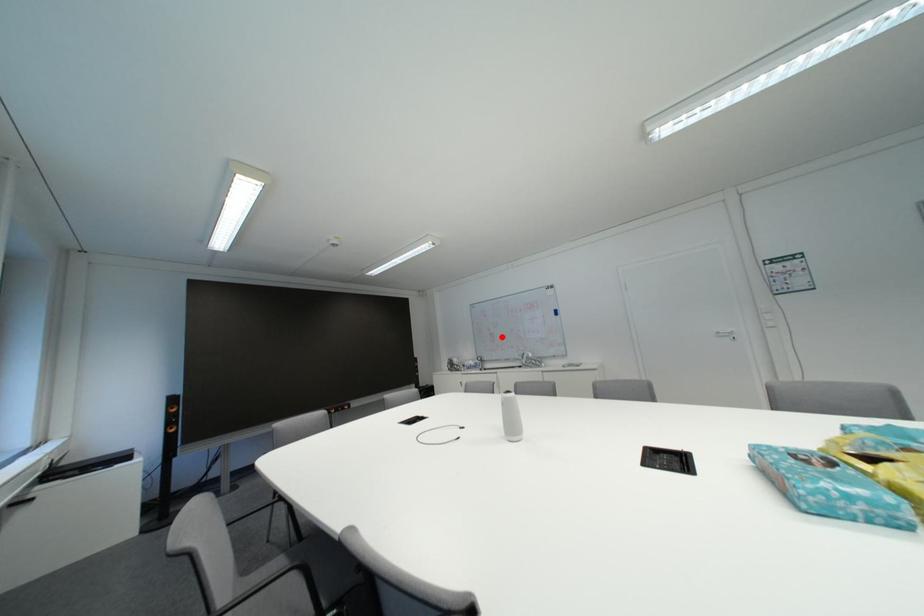
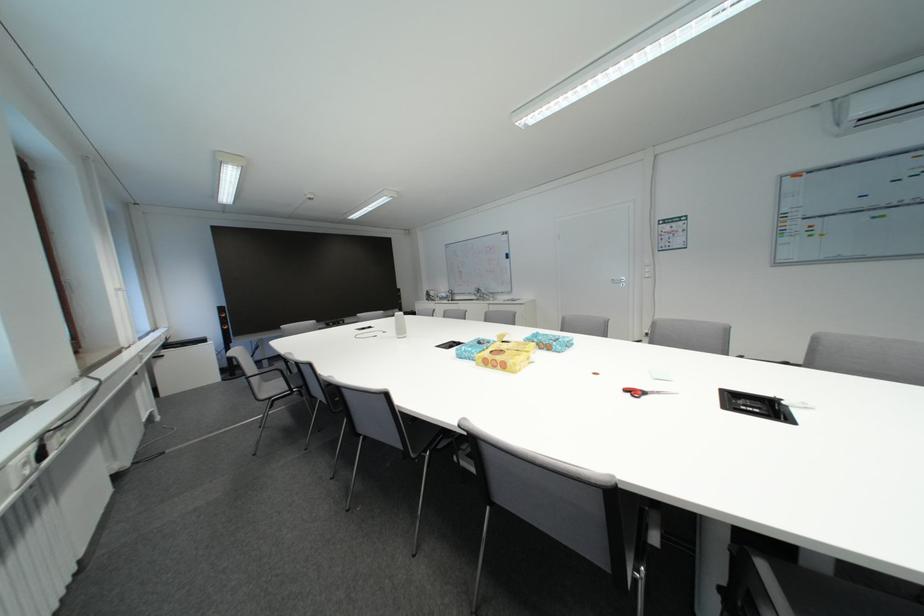
Question: I am providing you with two images of the same scene from different viewpoints. Image1 has a red point marked. In image2, the corresponding 3D location appears at what relative position? Reply with the corresponding letter.

Choices:
 (A) Closer
 (B) Farther

Answer: (A)